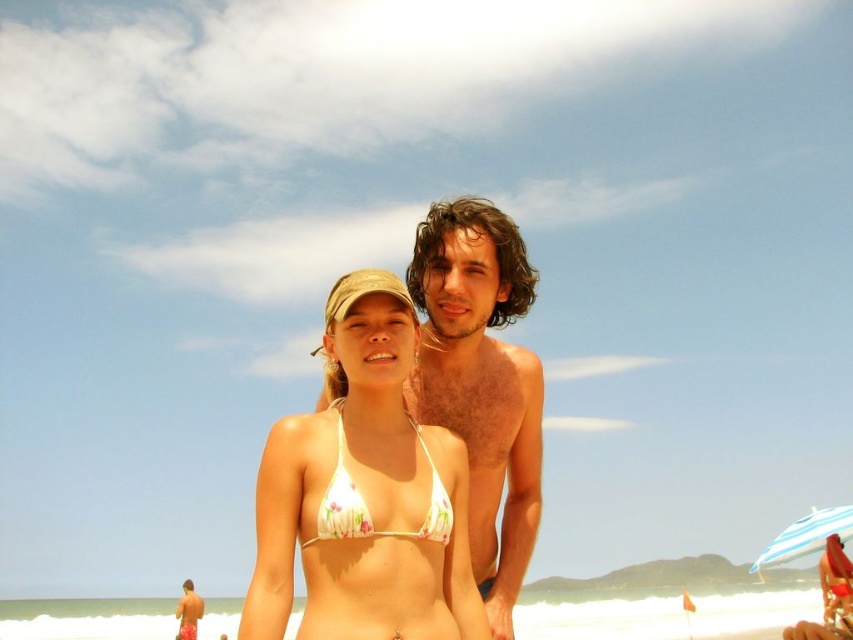
You are a photographer trying to capture a group photo of the floral print bikini top at center and the tan skin man at lower left. To ensure both subjects are fully visible, you need to adjust your camera angle. Based on their positions, which subject should you focus on first to frame them properly?

The floral print bikini top at center is wider than the tan skin man at lower left, so you should focus on framing the floral print bikini top at center first to ensure it fits within the frame before adjusting for the tan skin man at lower left.

You are a photographer trying to capture the perfect shot of the floral print bikini top at center. Given its exact coordinates at point 0.789, 0.430, where should you position your camera to ensure it is centered in the frame?

To center the floral print bikini top at center in the frame, position your camera so that the crosshairs align with the coordinates 0.789 on the horizontal axis and 0.430 on the vertical axis.